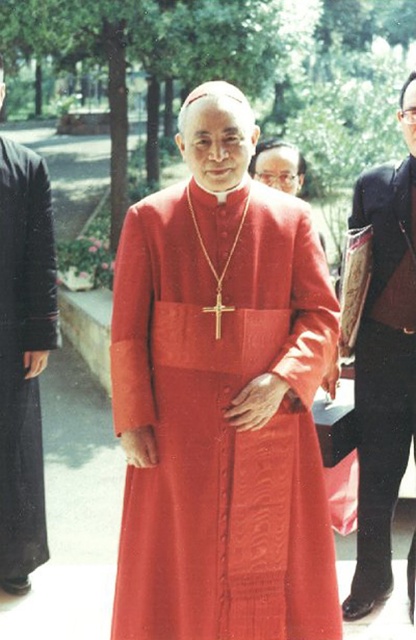
Looking at this image, is matte red robe at center smaller than matte red robe at right?

No, matte red robe at center is not smaller than matte red robe at right.

The height and width of the screenshot is (640, 416). What do you see at coordinates (222, 419) in the screenshot?
I see `matte red robe at center` at bounding box center [222, 419].

Locate an element on the screen. The image size is (416, 640). matte red robe at center is located at coordinates (222, 419).

Describe the element at coordinates (222, 419) in the screenshot. I see `matte red robe at center` at that location.

Is point (131, 321) less distant than point (4, 323)?

Yes, point (131, 321) is closer to viewer.

At what (x,y) coordinates should I click in order to perform the action: click on matte red robe at center. Please return your answer as a coordinate pair (x, y). The height and width of the screenshot is (640, 416). Looking at the image, I should click on click(x=222, y=419).

Who is higher up, matte red robe at right or black woolen robe at left?

black woolen robe at left is higher up.

Can you confirm if matte red robe at right is shorter than black woolen robe at left?

Correct, matte red robe at right is not as tall as black woolen robe at left.

At what (x,y) coordinates should I click in order to perform the action: click on matte red robe at right. Please return your answer as a coordinate pair (x, y). The image size is (416, 640). Looking at the image, I should click on (383, 372).